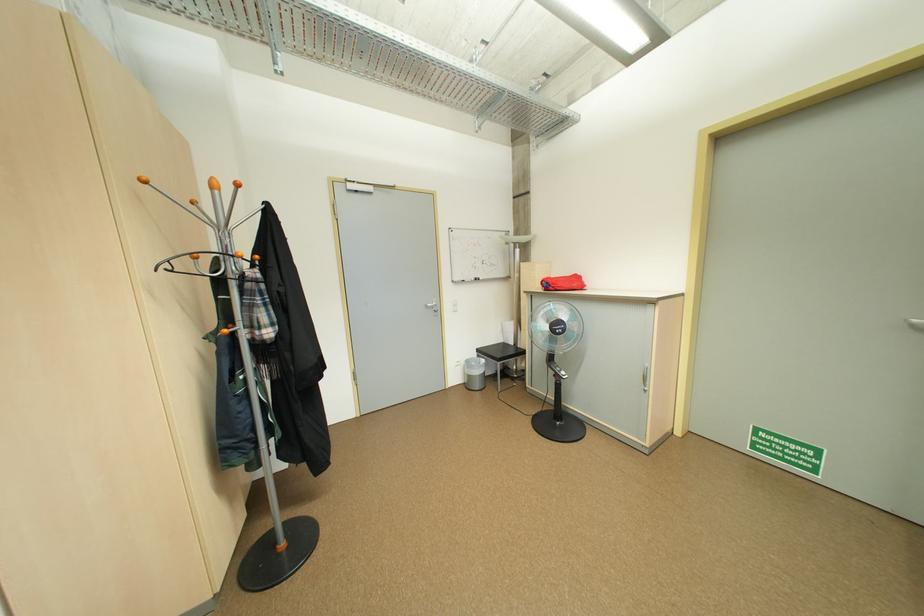
Where is `black stool sitting surface`? The width and height of the screenshot is (924, 616). black stool sitting surface is located at coordinates (500, 354).